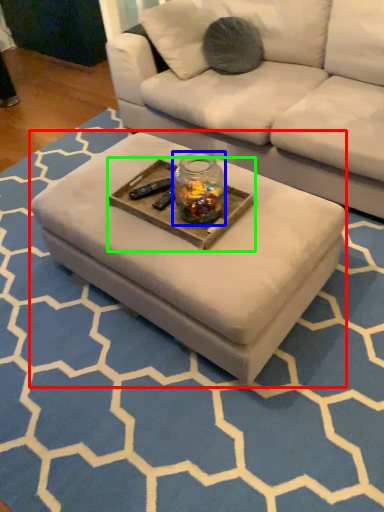
Question: Which object is the farthest from coffee table (highlighted by a red box)? Choose among these: glass jar (highlighted by a blue box) or round table (highlighted by a green box).

Choices:
 (A) glass jar
 (B) round table

Answer: (A)